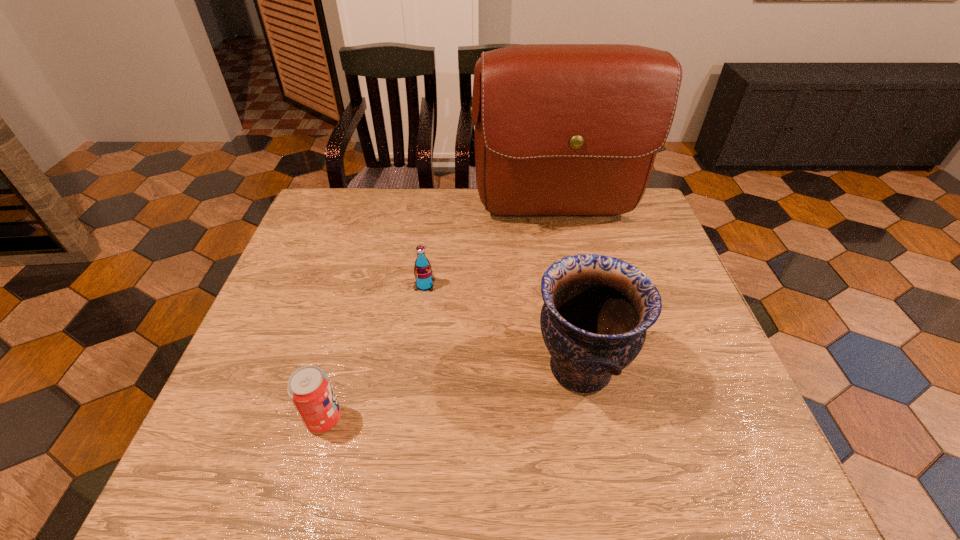
Where is `vacant space that's between the right soda and the left soda`? Image resolution: width=960 pixels, height=540 pixels. vacant space that's between the right soda and the left soda is located at coordinates (374, 352).

Point out which object is positioned as the second nearest to the second object from left to right. Please provide its 2D coordinates. Your answer should be formatted as a tuple, i.e. [(x, y)], where the tuple contains the x and y coordinates of a point satisfying the conditions above.

[(597, 309)]

Image resolution: width=960 pixels, height=540 pixels. In order to click on object that can be found as the closest to the left soda in this screenshot , I will do `click(423, 273)`.

Find the location of a particular element. free point that satisfies the following two spatial constraints: 1. on the open flap of the satchel; 2. on the front handle of the second tallest object is located at coordinates (588, 368).